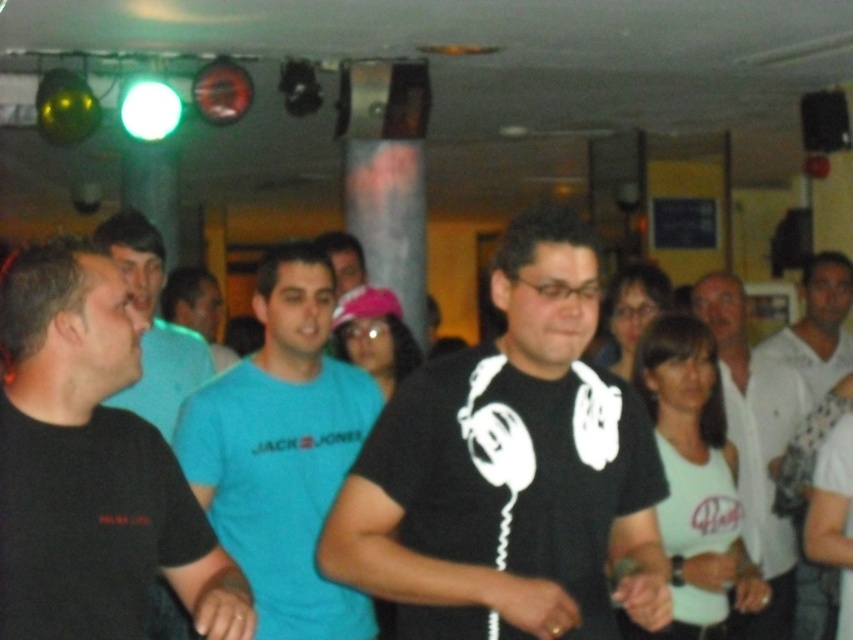
You are standing in the middle of the dance floor and see two points marked on the floor. The first point is at position point (287,268) and the second point is at position point (148,413). Which point is closer to you?

Point (287,268) is closer to the camera than point (148,413), so the first point is closer to you.